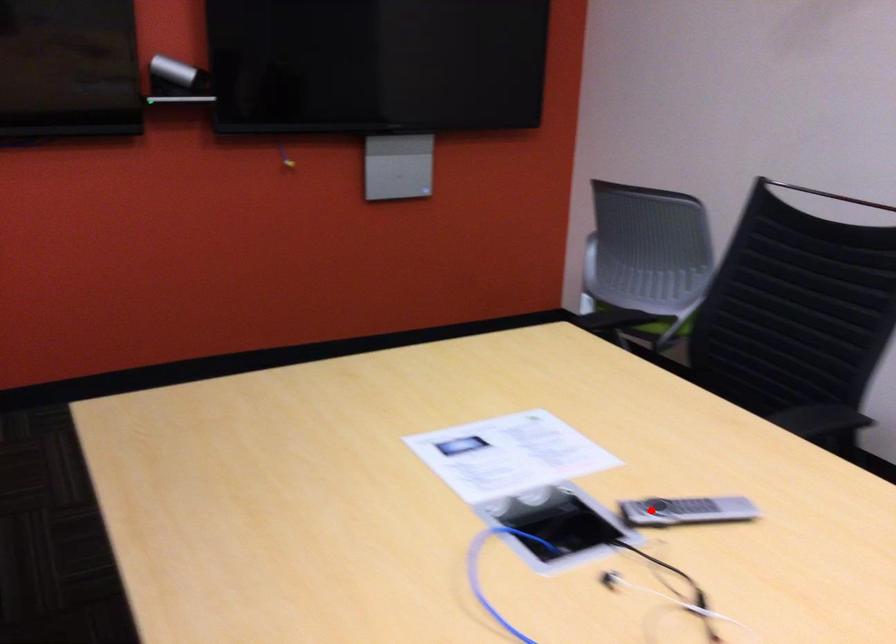
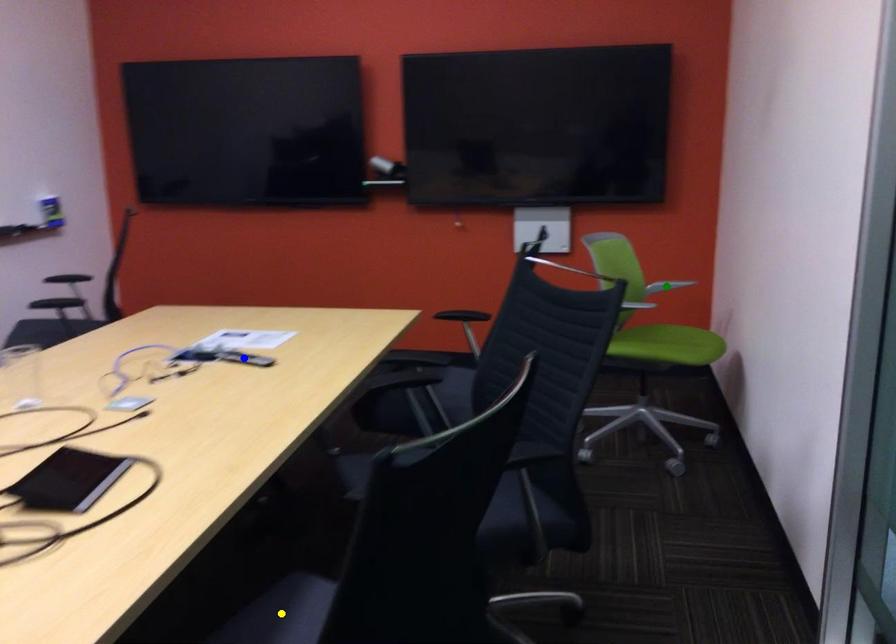
Question: I am providing you with two images of the same scene from different viewpoints. A red point is marked on the first image. You are given multiple points on the second image. Which point in image 2 represents the same 3d spot as the red point in image 1?

Choices:
 (A) yellow point
 (B) green point
 (C) blue point

Answer: (C)